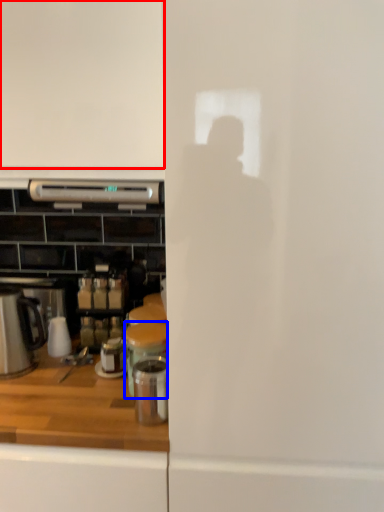
Question: Which object is further to the camera taking this photo, home appliance (highlighted by a red box) or appliance (highlighted by a blue box)?

Choices:
 (A) home appliance
 (B) appliance

Answer: (B)